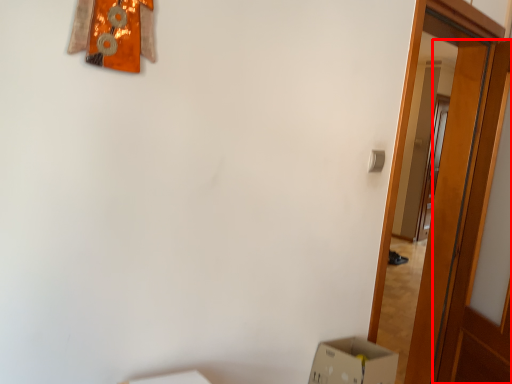
Question: From the image's perspective, where is door (annotated by the red box) located in relation to door in the image?

Choices:
 (A) below
 (B) above

Answer: (A)